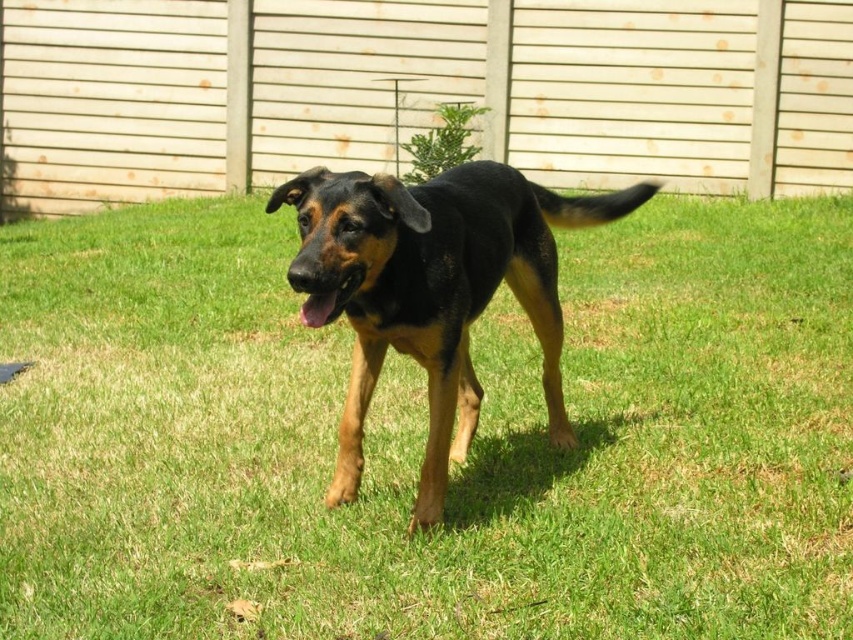
You are a small robot that can only move on surfaces shorter than you. You need to reach the wooden fence in the background. Can you safely walk across the green grass at center and the black smooth dog at center?

The green grass at center is shorter than the black smooth dog at center. Since the robot can only move on surfaces shorter than itself, it can walk on the green grass at center but not on the black smooth dog at center. Therefore, the robot should avoid the black smooth dog at center and use the green grass at center to reach the fence.

You are standing in the yard and see the black smooth dog at center and the green grass at center. Which object is positioned to the right of the other?

The green grass at center is to the right of the black smooth dog at center.